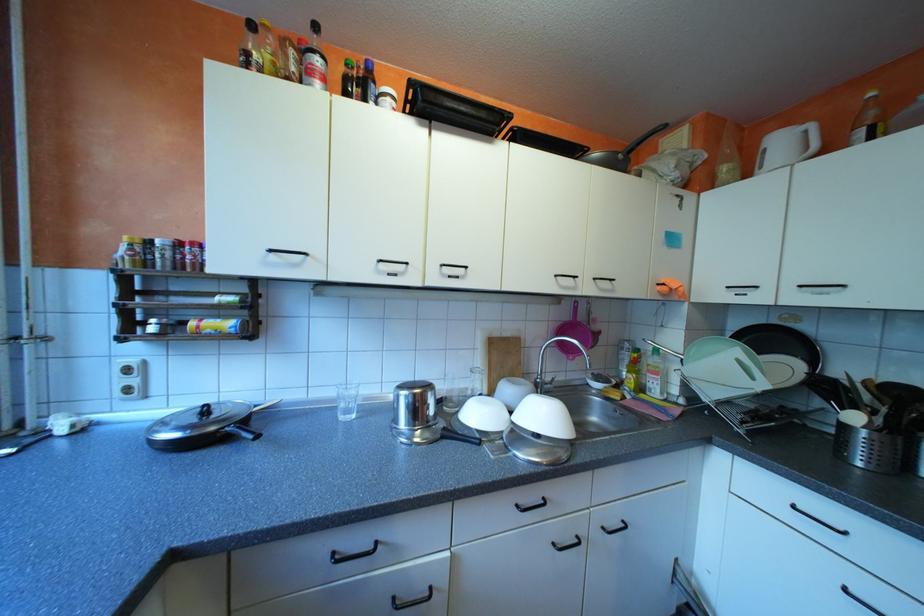
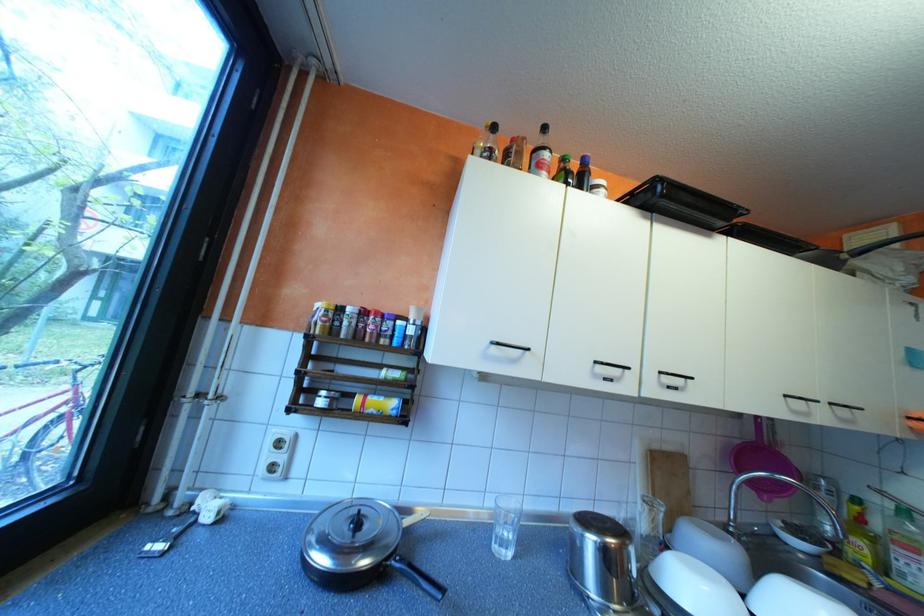
Where in the second image is the point corresponding to (x=553, y=378) from the first image?

(747, 525)